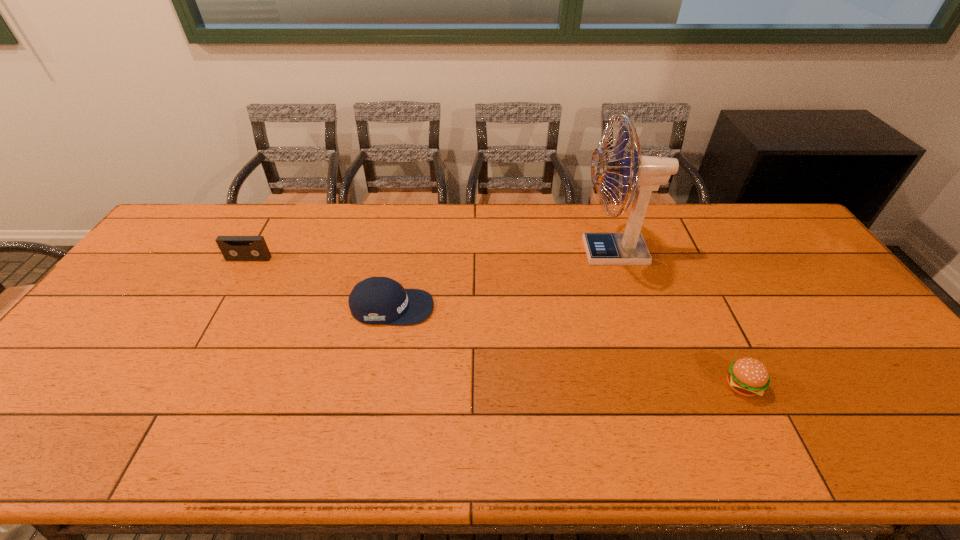
Locate an element on the screen. This screenshot has height=540, width=960. the tallest object is located at coordinates (647, 173).

Find the location of a particular element. This screenshot has height=540, width=960. the third object from left to right is located at coordinates click(x=647, y=173).

The width and height of the screenshot is (960, 540). What are the coordinates of `the third object from right to left` in the screenshot? It's located at (376, 300).

You are a GUI agent. You are given a task and a screenshot of the screen. Output one action in this format:
    pyautogui.click(x=<x>, y=<y>)
    Task: Click on the third farthest object
    
    Given the screenshot: What is the action you would take?
    pyautogui.click(x=376, y=300)

Identify the location of the leftmost object. This screenshot has height=540, width=960. [x=233, y=248].

In order to click on the nearest object in this screenshot , I will do `click(747, 376)`.

Locate an element on the screen. The width and height of the screenshot is (960, 540). the rightmost object is located at coordinates (747, 376).

You are a GUI agent. You are given a task and a screenshot of the screen. Output one action in this format:
    pyautogui.click(x=<x>, y=<y>)
    Task: Click on the vacant space located on the front-facing side of the fan
    The image size is (960, 540).
    Given the screenshot: What is the action you would take?
    pyautogui.click(x=469, y=252)

Identify the location of free space located on the front-facing side of the fan. (x=547, y=252).

Find the location of a particular element. The height and width of the screenshot is (540, 960). vacant space located 0.220m on the front-facing side of the fan is located at coordinates (510, 252).